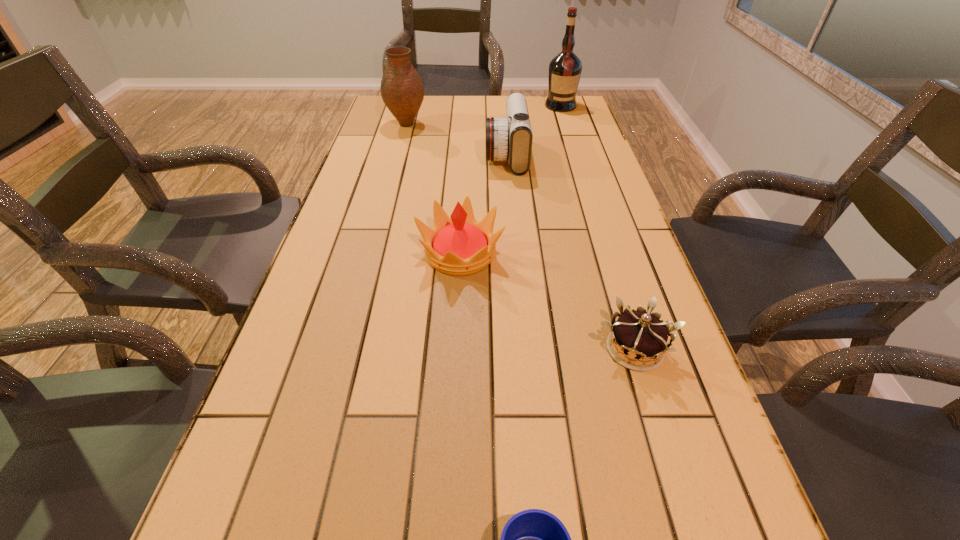
Where is `vacant space located on the front of the fifth shortest object`? Image resolution: width=960 pixels, height=540 pixels. vacant space located on the front of the fifth shortest object is located at coordinates (386, 200).

Find the location of a particular element. blank area located on the surface of the camcorder is located at coordinates (364, 155).

In order to click on free space located on the surface of the camcorder in this screenshot , I will do `click(442, 155)`.

The width and height of the screenshot is (960, 540). Identify the location of free space located on the surface of the camcorder. (420, 155).

Identify the location of vacant space located on the back of the left crown. This screenshot has width=960, height=540. (466, 151).

The width and height of the screenshot is (960, 540). I want to click on free space located 0.050m on the left of the right crown, so click(570, 349).

In order to click on liquor at the far edge in this screenshot , I will do `click(565, 69)`.

You are a GUI agent. You are given a task and a screenshot of the screen. Output one action in this format:
    pyautogui.click(x=<x>, y=<y>)
    Task: Click on the vase that is at the far edge
    The width and height of the screenshot is (960, 540).
    Given the screenshot: What is the action you would take?
    pyautogui.click(x=402, y=90)

Image resolution: width=960 pixels, height=540 pixels. Find the location of `object present at the left edge`. object present at the left edge is located at coordinates (402, 90).

This screenshot has height=540, width=960. I want to click on liquor present at the right edge, so click(x=565, y=69).